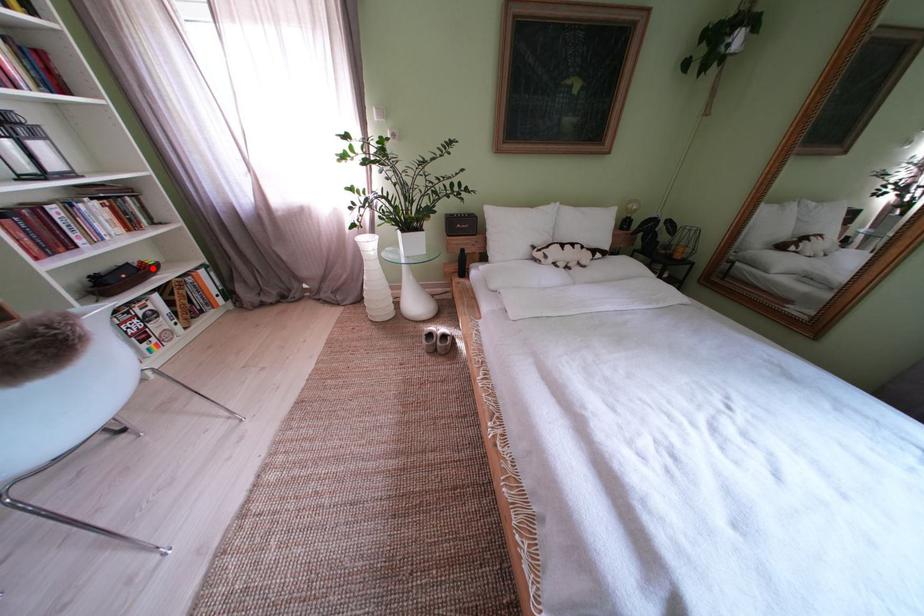
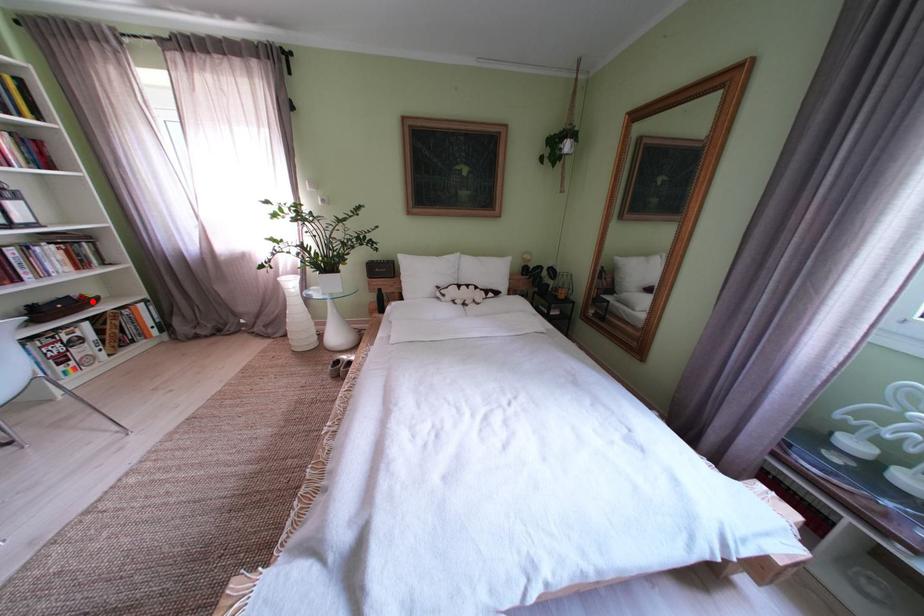
I am providing you with two images of the same scene from different viewpoints. A red point is marked on the first image and another point is marked on the second image. Do the highlighted points in image1 and image2 indicate the same real-world spot?

Yes